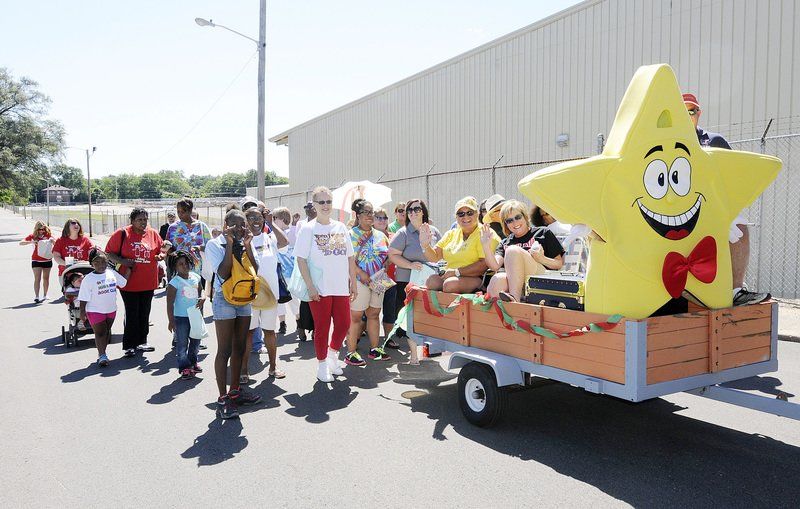
Where is `green and red hanging ribbons`? green and red hanging ribbons is located at coordinates (428, 297), (556, 338).